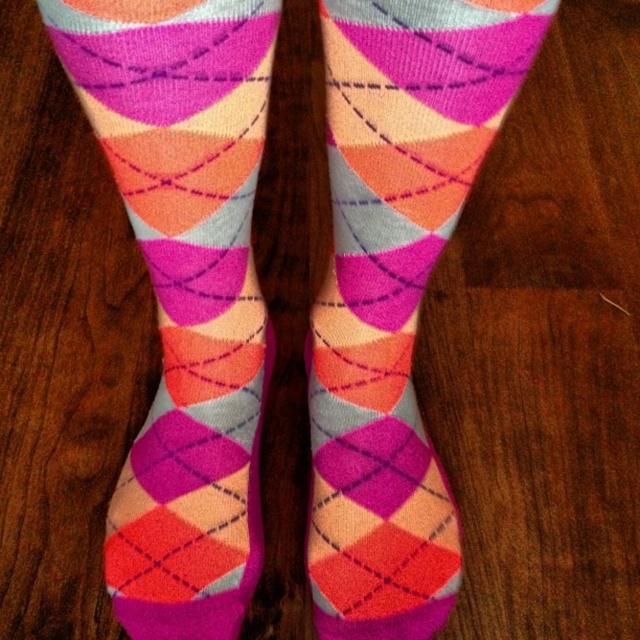
You are organizing a sock drawer and see the knitted argyle socks at center and the matte argyle socks at center. Which sock is on top?

The knitted argyle socks at center is positioned over matte argyle socks at center, so the knitted argyle socks at center is on top.

You are trying to pick up the knitted argyle socks at center and the matte argyle socks at center from the wooden surface. Which one should you reach for first to grab the one closer to you?

The knitted argyle socks at center is closer to the viewer than the matte argyle socks at center, so you should reach for the knitted argyle socks at center first.

You are standing in front of the wooden surface with the vibrant argyle socks. There are two points marked on the socks, one at point (234, 77) and the other at point (326, 118). Which point is closer to you?

Point (234, 77) is closer to you because it is in front of point (326, 118).